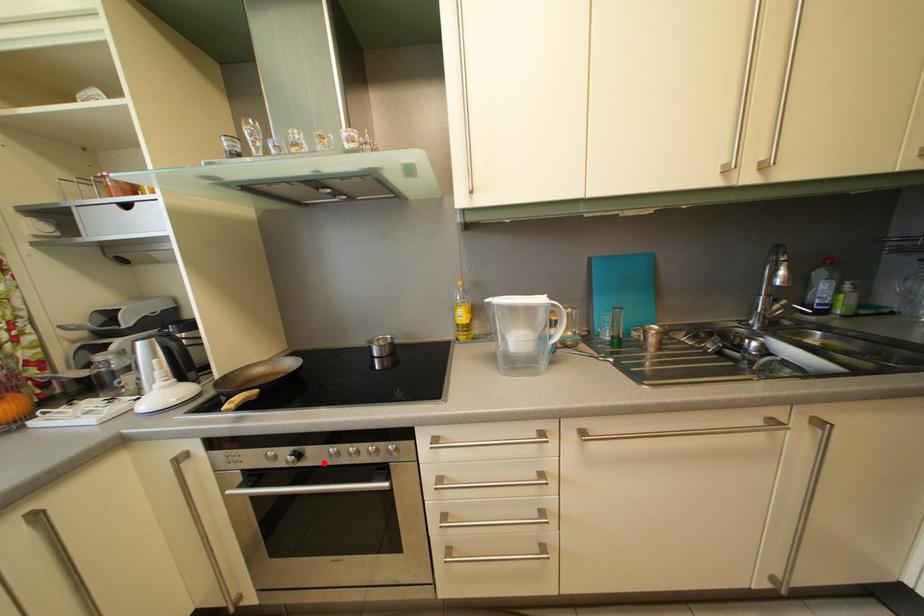
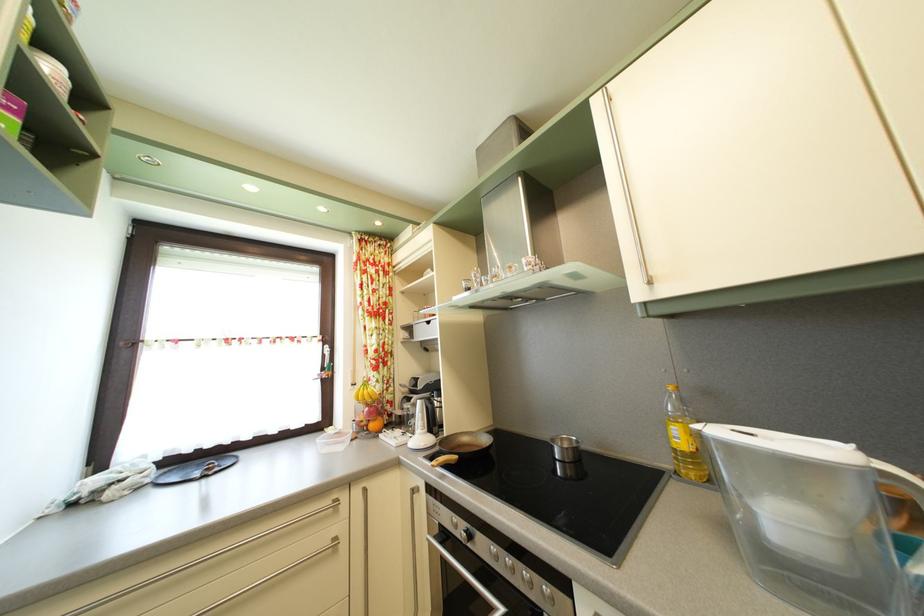
In the second image, find the point that corresponds to the highlighted location in the first image.

(490, 553)